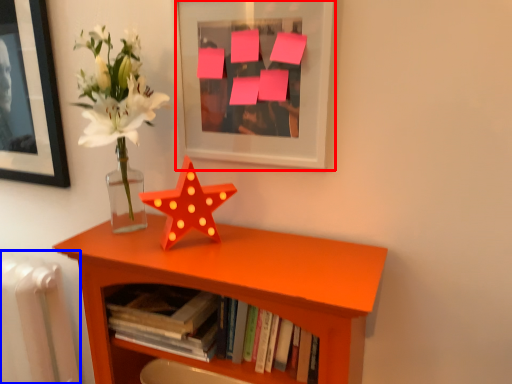
Question: Which object appears closest to the camera in this image, picture frame (highlighted by a red box) or radiator (highlighted by a blue box)?

Choices:
 (A) picture frame
 (B) radiator

Answer: (A)